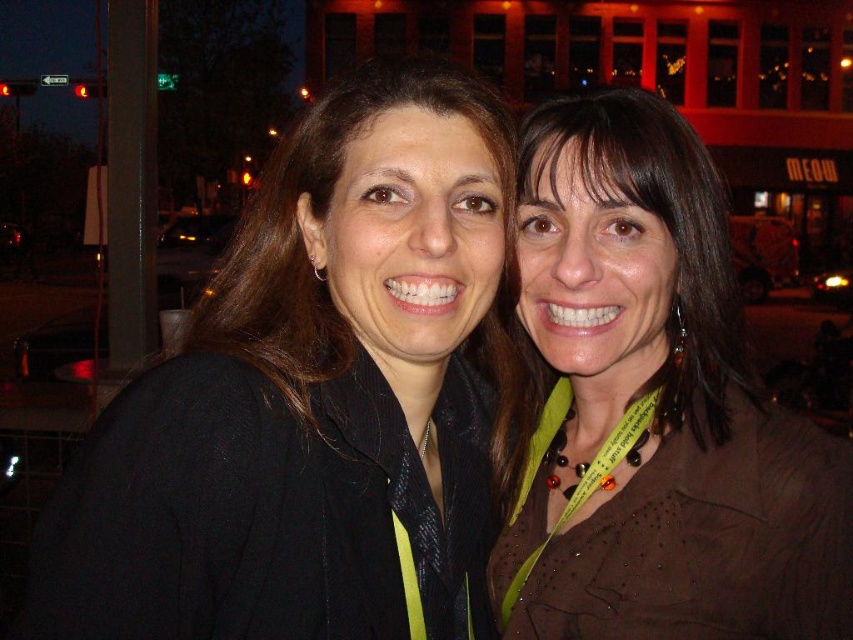
Who is more forward, [705,212] or [618,118]?

Point [618,118]

Between brown matte shirt at center and brown matte hair at right, which one is positioned higher?

brown matte hair at right is above.

Image resolution: width=853 pixels, height=640 pixels. Describe the element at coordinates (654, 406) in the screenshot. I see `brown matte shirt at center` at that location.

In order to click on brown matte shirt at center in this screenshot , I will do `click(654, 406)`.